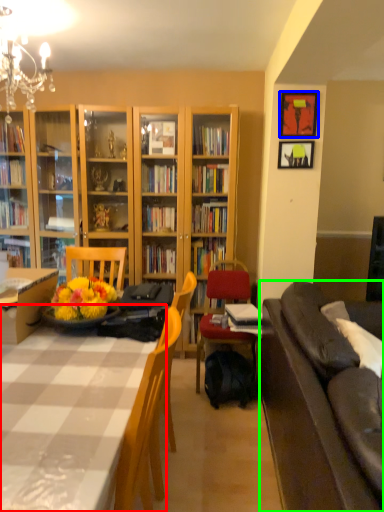
Question: Considering the real-world distances, which object is farthest from table (highlighted by a red box)? picture frame (highlighted by a blue box) or studio couch (highlighted by a green box)?

Choices:
 (A) picture frame
 (B) studio couch

Answer: (A)